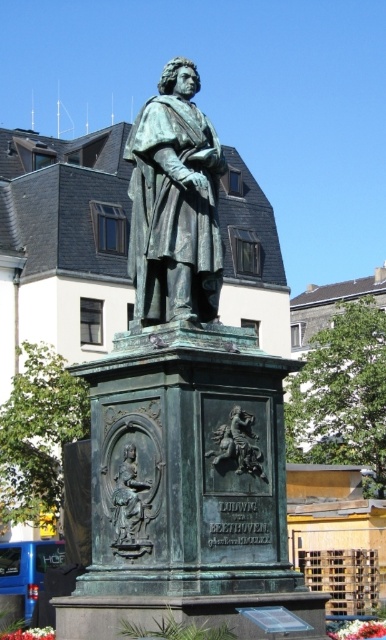
You are standing in front of the bronze statue of Beethoven in the public square. There are two points marked on the statue base. The first point is at coordinates point (206, 150) and the second is at point (133, 474). If you were to walk towards the statue, which point would appear closer to you?

Point (206, 150) is further to the viewer than point (133, 474), so the first point would appear closer to you as you approach the statue.

You are an art student tasked with sketching the bronze statue at center. To ensure accuracy, you need to determine its exact position relative to the garden entrance located at coordinates point A. Can you confirm if the statue is positioned to the left or right of point A?

The bronze statue at center is located at point coordinates point A. Since the statue is at the center of the image, it is positioned directly in front of point A, neither to the left nor right.